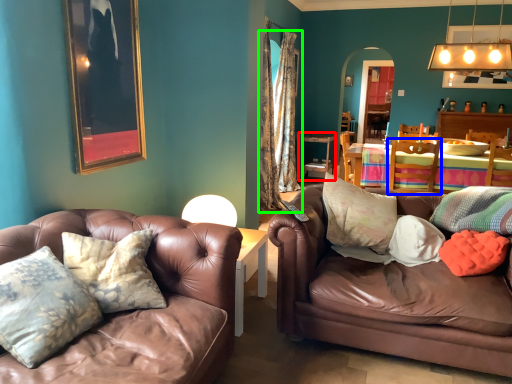
Question: Estimate the real-world distances between objects in this image. Which object is closer to table (highlighted by a red box), chair (highlighted by a blue box) or curtain (highlighted by a green box)?

Choices:
 (A) chair
 (B) curtain

Answer: (B)